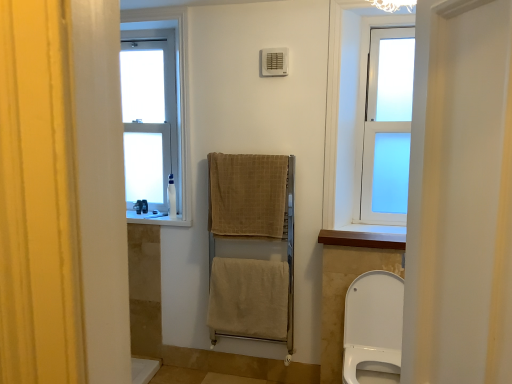
What do you see at coordinates (170, 197) in the screenshot? This screenshot has height=384, width=512. I see `white plastic bottle at left, which is the second toiletry from back to front` at bounding box center [170, 197].

What do you see at coordinates (249, 298) in the screenshot? The width and height of the screenshot is (512, 384). I see `beige cotton towel at center, arranged as the 3th bath towel when viewed from the top` at bounding box center [249, 298].

At what (x,y) coordinates should I click in order to perform the action: click on beige cotton towel at center, arranged as the 3th bath towel when viewed from the top. Please return your answer as a coordinate pair (x, y). Looking at the image, I should click on (249, 298).

Measure the distance between white plastic bottle at left, which ranks as the 1th toiletry in back-to-front order, and camera.

white plastic bottle at left, which ranks as the 1th toiletry in back-to-front order, and camera are 9.69 feet apart.

The height and width of the screenshot is (384, 512). What do you see at coordinates (247, 195) in the screenshot? I see `beige woven towel at center, the 3th bath towel from the bottom` at bounding box center [247, 195].

Identify the location of white frosted glass window at upper left, the second window in the front-to-back sequence. The width and height of the screenshot is (512, 384). (150, 116).

From the picture: Considering the sizes of objects white glossy toilet at lower right and white plastic window sill at center, the 1th window sill viewed from the top, in the image provided, who is wider, white glossy toilet at lower right or white plastic window sill at center, the 1th window sill viewed from the top,?

white glossy toilet at lower right.

Is white glossy toilet at lower right oriented away from white plastic window sill at center, which is counted as the 1th window sill, starting from the back?

That's not correct — white glossy toilet at lower right is not looking away from white plastic window sill at center, which is counted as the 1th window sill, starting from the back.

Is white glossy toilet at lower right not inside white plastic window sill at center, acting as the second window sill starting from the front?

Yes, white glossy toilet at lower right is outside of white plastic window sill at center, acting as the second window sill starting from the front.

Is white glossy toilet at lower right closer to the viewer compared to white plastic window sill at center, the 1th window sill viewed from the top?

Yes, it is in front of white plastic window sill at center, the 1th window sill viewed from the top.

Consider the image. Is beige woven towel at center, which appears as the first bath towel when viewed from the top, completely or partially outside of white plastic window sill at center, which is counted as the 1th window sill, starting from the back?

Yes, beige woven towel at center, which appears as the first bath towel when viewed from the top, is not within white plastic window sill at center, which is counted as the 1th window sill, starting from the back.

From the picture: From the image's perspective, relative to white plastic window sill at center, which is counted as the 1th window sill, starting from the back, is beige woven towel at center, which appears as the first bath towel when viewed from the top, above or below?

beige woven towel at center, which appears as the first bath towel when viewed from the top, is situated higher than white plastic window sill at center, which is counted as the 1th window sill, starting from the back, in the image.

From a real-world perspective, who is located lower, beige woven towel at center, the 3th bath towel from the bottom, or white plastic window sill at center, positioned as the first window sill in left-to-right order?

white plastic window sill at center, positioned as the first window sill in left-to-right order, is physically lower.

Is white plastic bottle at left, the first toiletry from the left, shorter than beige woven towel at center, the second bath towel when ordered from top to bottom?

Correct, white plastic bottle at left, the first toiletry from the left, is not as tall as beige woven towel at center, the second bath towel when ordered from top to bottom.

Which of these two, white plastic bottle at left, the first toiletry from the left, or beige woven towel at center, the second bath towel when ordered from top to bottom, is smaller?

With smaller size is white plastic bottle at left, the first toiletry from the left.

Which object is wider, white plastic bottle at left, which ranks as the 1th toiletry in back-to-front order, or beige woven towel at center, positioned as the 2th bath towel in bottom-to-top order?

With larger width is beige woven towel at center, positioned as the 2th bath towel in bottom-to-top order.

Which is behind, white plastic bottle at left, arranged as the second toiletry when viewed from the right, or beige woven towel at center, positioned as the 2th bath towel in bottom-to-top order?

white plastic bottle at left, arranged as the second toiletry when viewed from the right, is behind.

From a real-world perspective, count 3rd bath towels downward from the white frosted glass window at upper left, the 1th window positioned from the back, and point to it. Please provide its 2D coordinates.

[(249, 298)]

Looking at this image, is white frosted glass window at upper left, the 1th window positioned from the back, at the right side of beige cotton towel at center, arranged as the 3th bath towel when viewed from the top?

In fact, white frosted glass window at upper left, the 1th window positioned from the back, is to the left of beige cotton towel at center, arranged as the 3th bath towel when viewed from the top.

Is white frosted glass window at upper left, the second window in the front-to-back sequence, inside the boundaries of beige cotton towel at center, arranged as the 3th bath towel when viewed from the top, or outside?

The correct answer is: outside.

Consider the image. Can you tell me how much white frosted glass window at upper left, which ranks as the 2th window in right-to-left order, and beige cotton towel at center, arranged as the 3th bath towel when viewed from the top, differ in facing direction?

There is a 0.376-degree angle between the facing directions of white frosted glass window at upper left, which ranks as the 2th window in right-to-left order, and beige cotton towel at center, arranged as the 3th bath towel when viewed from the top.

From the image's perspective, is beige woven towel at center, the second bath towel when ordered from top to bottom, under white frosted glass window at upper right, the first window in the front-to-back sequence?

Indeed, from the image's perspective, beige woven towel at center, the second bath towel when ordered from top to bottom, is shown beneath white frosted glass window at upper right, the first window in the front-to-back sequence.

Which object is further away from the camera, beige woven towel at center, positioned as the 2th bath towel in bottom-to-top order, or white frosted glass window at upper right, which ranks as the 2th window in left-to-right order?

beige woven towel at center, positioned as the 2th bath towel in bottom-to-top order, is further away from the camera.

From a real-world perspective, between beige woven towel at center, the second bath towel when ordered from top to bottom, and white frosted glass window at upper right, acting as the second window starting from the back, who is vertically higher?

In real-world perspective, white frosted glass window at upper right, acting as the second window starting from the back, is above.

From the image's perspective, is white plastic window sill at center, positioned as the first window sill in left-to-right order, beneath beige cotton towel at center, positioned as the first bath towel in bottom-to-top order?

No, from the image's perspective, white plastic window sill at center, positioned as the first window sill in left-to-right order, is not below beige cotton towel at center, positioned as the first bath towel in bottom-to-top order.

Based on the photo, who is smaller, white plastic window sill at center, positioned as the first window sill in left-to-right order, or beige cotton towel at center, positioned as the first bath towel in bottom-to-top order?

white plastic window sill at center, positioned as the first window sill in left-to-right order, is smaller.

How far apart are white plastic window sill at center, positioned as the first window sill in left-to-right order, and beige cotton towel at center, arranged as the 3th bath towel when viewed from the top?

The distance of white plastic window sill at center, positioned as the first window sill in left-to-right order, from beige cotton towel at center, arranged as the 3th bath towel when viewed from the top, is 61.14 centimeters.

Is white plastic window sill at center, the 1th window sill viewed from the top, positioned with its back to beige cotton towel at center, positioned as the first bath towel in bottom-to-top order?

No.

Which is correct: white frosted glass window at upper left, the second window in the front-to-back sequence, is inside white plastic bottle at left, placed as the second toiletry when sorted from front to back, or outside of it?

The correct answer is: outside.

Which object is positioned more to the left, white frosted glass window at upper left, which is the 1th window in left-to-right order, or white plastic bottle at left, which ranks as the 1th toiletry in back-to-front order?

white plastic bottle at left, which ranks as the 1th toiletry in back-to-front order.

From the image's perspective, does white frosted glass window at upper left, which is the 1th window in left-to-right order, appear lower than white plastic bottle at left, which ranks as the 1th toiletry in back-to-front order?

No.

Locate an element on the screen. window sill that is on the left side of white glossy toilet at lower right is located at coordinates (158, 219).

Find the location of a particular element. Image resolution: width=512 pixels, height=384 pixels. the 1st window sill located beneath the beige woven towel at center, which appears as the first bath towel when viewed from the top (from a real-world perspective) is located at coordinates (158, 219).

Looking at the image, which one is located further to white plastic bottle at left, placed as the second toiletry when sorted from front to back, white frosted glass window at upper right, acting as the second window starting from the back, or white frosted glass window at upper left, the 1th window positioned from the back?

white frosted glass window at upper right, acting as the second window starting from the back, is positioned further to the anchor white plastic bottle at left, placed as the second toiletry when sorted from front to back.

Estimate the real-world distances between objects in this image. Which object is further from white frosted glass window at upper left, which ranks as the 2th window in right-to-left order, wooden at upper center, positioned as the 2th window sill in back-to-front order, or beige woven towel at center, which appears as the first bath towel when viewed from the top?

The object further to white frosted glass window at upper left, which ranks as the 2th window in right-to-left order, is wooden at upper center, positioned as the 2th window sill in back-to-front order.

From the image, which object appears to be farther from white glossy toilet at lower right, beige woven towel at center, the second bath towel when ordered from top to bottom, or white frosted glass window at upper left, the second window in the front-to-back sequence?

white frosted glass window at upper left, the second window in the front-to-back sequence, lies further to white glossy toilet at lower right than the other object.

Looking at the image, which one is located closer to white frosted glass window at upper right, the first window in the front-to-back sequence, white frosted glass window at upper left, which ranks as the 2th window in right-to-left order, or beige cotton towel at center, positioned as the first bath towel in bottom-to-top order?

The object closer to white frosted glass window at upper right, the first window in the front-to-back sequence, is beige cotton towel at center, positioned as the first bath towel in bottom-to-top order.

Looking at the image, which one is located further to beige woven towel at center, the second bath towel when ordered from top to bottom, white frosted glass window at upper left, which ranks as the 2th window in right-to-left order, or white plastic window sill at center, the 2th window sill in the right-to-left sequence?

Among the two, white frosted glass window at upper left, which ranks as the 2th window in right-to-left order, is located further to beige woven towel at center, the second bath towel when ordered from top to bottom.

Based on the photo, from the image, which object appears to be farther from white glossy toilet at lower right, beige woven towel at center, positioned as the 2th bath towel in bottom-to-top order, or white plastic bottle at left, which is the second toiletry from back to front?

white plastic bottle at left, which is the second toiletry from back to front.

From the image, which object appears to be farther from white frosted glass window at upper right, the first window in the front-to-back sequence, wooden at upper center, which appears as the 1th window sill when viewed from the right, or white frosted glass window at upper left, the 1th window positioned from the back?

white frosted glass window at upper left, the 1th window positioned from the back, is further to white frosted glass window at upper right, the first window in the front-to-back sequence.

Which object lies further to the anchor point white plastic bottle at left, which is counted as the 1th toiletry, starting from the right, beige woven towel at center, the 3th bath towel from the bottom, or white frosted glass window at upper right, the first window in the front-to-back sequence?

Based on the image, white frosted glass window at upper right, the first window in the front-to-back sequence, appears to be further to white plastic bottle at left, which is counted as the 1th toiletry, starting from the right.

The image size is (512, 384). Identify the location of toiletry between white frosted glass window at upper left, the 1th window positioned from the back, and beige woven towel at center, the 3th bath towel from the bottom, in the horizontal direction. (170, 197).

Identify the location of toiletry between white plastic bottle at left, placed as the second toiletry when sorted from front to back, and white frosted glass window at upper right, which ranks as the 2th window in left-to-right order. (170, 197).

Identify the location of toilet between white plastic bottle at left, which ranks as the 1th toiletry in back-to-front order, and wooden at upper center, which is the first window sill from bottom to top, in the horizontal direction. The height and width of the screenshot is (384, 512). (373, 329).

The height and width of the screenshot is (384, 512). Identify the location of bath towel between white frosted glass window at upper left, which ranks as the 2th window in right-to-left order, and beige woven towel at center, positioned as the 2th bath towel in bottom-to-top order, in the vertical direction. (247, 195).